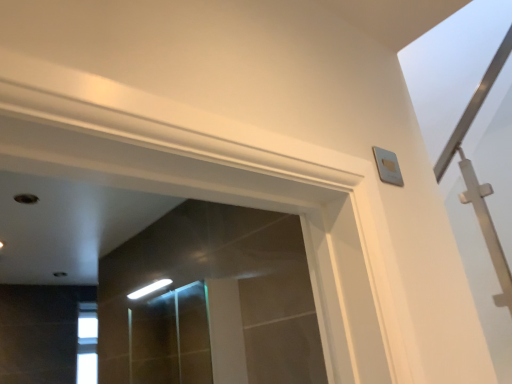
Question: Should I look upward or downward to see clear glass screen door at center?

Choices:
 (A) down
 (B) up

Answer: (A)